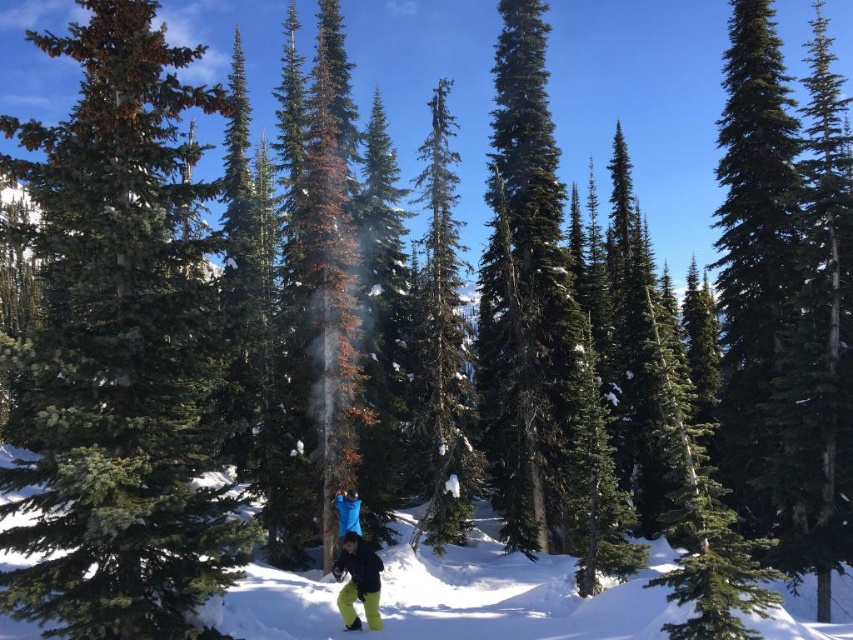
Does green matte tree at center have a greater width compared to neon yellow pants at center?

Correct, the width of green matte tree at center exceeds that of neon yellow pants at center.

Can you confirm if green matte tree at center is positioned below neon yellow pants at center?

No.

Is point (47, 410) less distant than point (378, 566)?

Yes, it is.

Where is `green matte tree at center`? green matte tree at center is located at coordinates (119, 352).

Who is positioned more to the left, green matte tree at center or white powdery snow at center?

green matte tree at center is more to the left.

In the scene shown: Measure the distance between point (57, 157) and camera.

A distance of 11.93 meters exists between point (57, 157) and camera.

Is point (202, 586) positioned behind point (299, 628)?

No, (202, 586) is closer to viewer.

This screenshot has height=640, width=853. What are the coordinates of `green matte tree at center` in the screenshot? It's located at (119, 352).

Between white powdery snow at center and neon yellow pants at center, which one appears on the right side from the viewer's perspective?

From the viewer's perspective, neon yellow pants at center appears more on the right side.

This screenshot has width=853, height=640. Describe the element at coordinates (514, 596) in the screenshot. I see `white powdery snow at center` at that location.

Locate an element on the screen. white powdery snow at center is located at coordinates (514, 596).